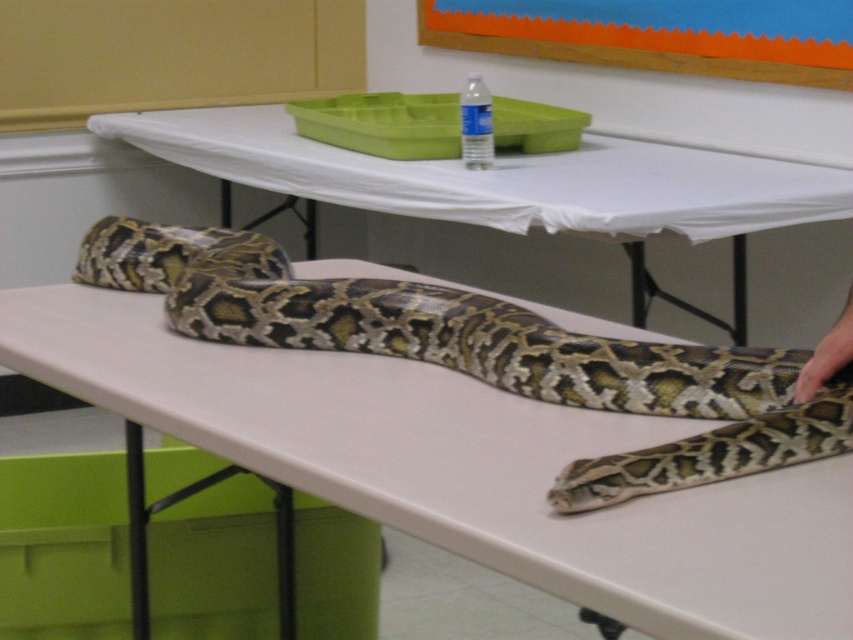
Does smooth white table at center have a lesser height compared to orange matte bulletin board at upper center?

No, smooth white table at center is not shorter than orange matte bulletin board at upper center.

Image resolution: width=853 pixels, height=640 pixels. Find the location of `smooth white table at center`. smooth white table at center is located at coordinates (502, 179).

The image size is (853, 640). In order to click on smooth white table at center in this screenshot , I will do `click(502, 179)`.

In the scene shown: Is patterned scales snake at center bigger than orange matte bulletin board at upper center?

Incorrect, patterned scales snake at center is not larger than orange matte bulletin board at upper center.

From the picture: Is patterned scales snake at center behind orange matte bulletin board at upper center?

No.

Is point (525, 353) more distant than point (651, 61)?

No, (525, 353) is in front of (651, 61).

Locate an element on the screen. The width and height of the screenshot is (853, 640). patterned scales snake at center is located at coordinates (486, 355).

Is patterned scales snake at center to the left of smooth white table at center from the viewer's perspective?

Yes, patterned scales snake at center is to the left of smooth white table at center.

Is patterned scales snake at center closer to camera compared to smooth white table at center?

Yes, patterned scales snake at center is in front of smooth white table at center.

At what (x,y) coordinates should I click in order to perform the action: click on patterned scales snake at center. Please return your answer as a coordinate pair (x, y). Looking at the image, I should click on (486, 355).

The image size is (853, 640). What are the coordinates of `patterned scales snake at center` in the screenshot? It's located at (486, 355).